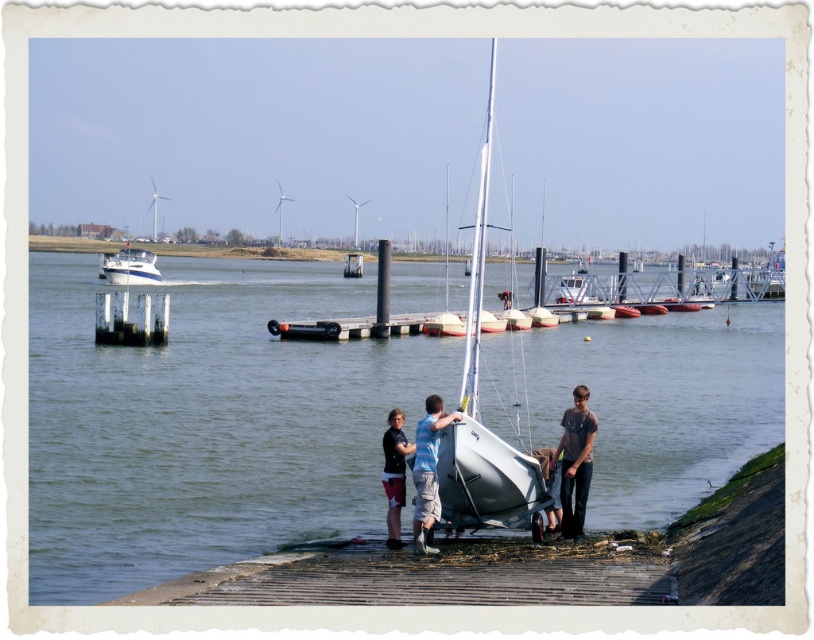
Between dark gray jeans at lower right and white glossy boat at upper left, which one appears on the left side from the viewer's perspective?

Positioned to the left is white glossy boat at upper left.

Does point (559, 500) lie behind point (130, 259)?

No, it is not.

What do you see at coordinates (575, 461) in the screenshot?
I see `dark gray jeans at lower right` at bounding box center [575, 461].

Locate an element on the screen. This screenshot has height=640, width=814. dark gray jeans at lower right is located at coordinates (575, 461).

Between clear water at lower center and white glossy boat at upper left, which one is positioned higher?

white glossy boat at upper left is above.

Is clear water at lower center below white glossy boat at upper left?

Yes.

Which is behind, point (59, 381) or point (152, 269)?

The point (152, 269) is more distant.

Identify the location of clear water at lower center. (204, 422).

What do you see at coordinates (432, 577) in the screenshot? The image size is (814, 640). I see `wooden planks at lower center` at bounding box center [432, 577].

Is point (600, 564) less distant than point (392, 442)?

Yes, point (600, 564) is in front of point (392, 442).

This screenshot has height=640, width=814. I want to click on wooden planks at lower center, so click(432, 577).